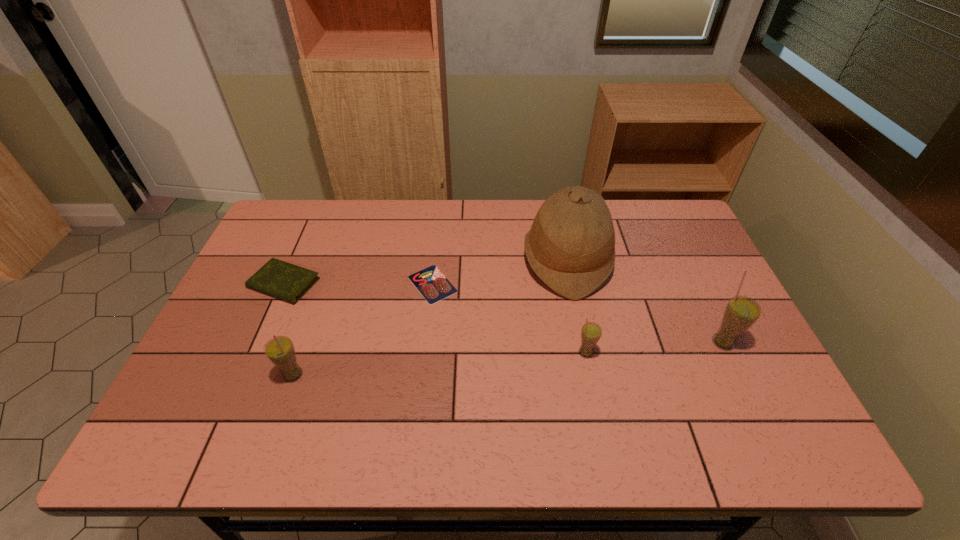
Where is `vacant space positioned on the right of the nearest straw for drinking`? Image resolution: width=960 pixels, height=540 pixels. vacant space positioned on the right of the nearest straw for drinking is located at coordinates coord(395,375).

I want to click on free spot located on the right of the shortest straw for drinking, so click(739, 353).

Find the location of a particular element. vacant space located on the back of the rightmost straw for drinking is located at coordinates (697, 288).

This screenshot has width=960, height=540. I want to click on free space located on the back of the shortest object, so click(441, 210).

Image resolution: width=960 pixels, height=540 pixels. Identify the location of vacant space located on the front-facing side of the hat. (485, 260).

You are a GUI agent. You are given a task and a screenshot of the screen. Output one action in this format:
    pyautogui.click(x=<x>, y=<y>)
    Task: Click on the blank space located 0.080m on the front-facing side of the hat
    
    Given the screenshot: What is the action you would take?
    pyautogui.click(x=497, y=260)

Where is `free space located 0.310m on the front-facing side of the hat`? This screenshot has width=960, height=540. free space located 0.310m on the front-facing side of the hat is located at coordinates (424, 260).

Find the location of a particular element. The image size is (960, 540). free space located 0.180m on the right of the diary is located at coordinates [x=379, y=283].

Image resolution: width=960 pixels, height=540 pixels. Identify the location of object present at the far edge. (571, 245).

I want to click on object located at the near edge, so click(x=280, y=350).